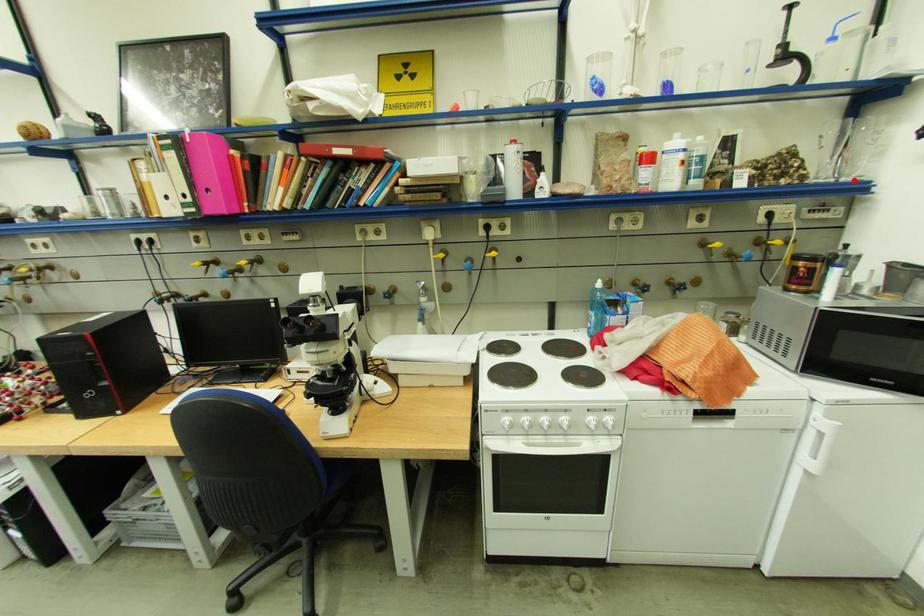
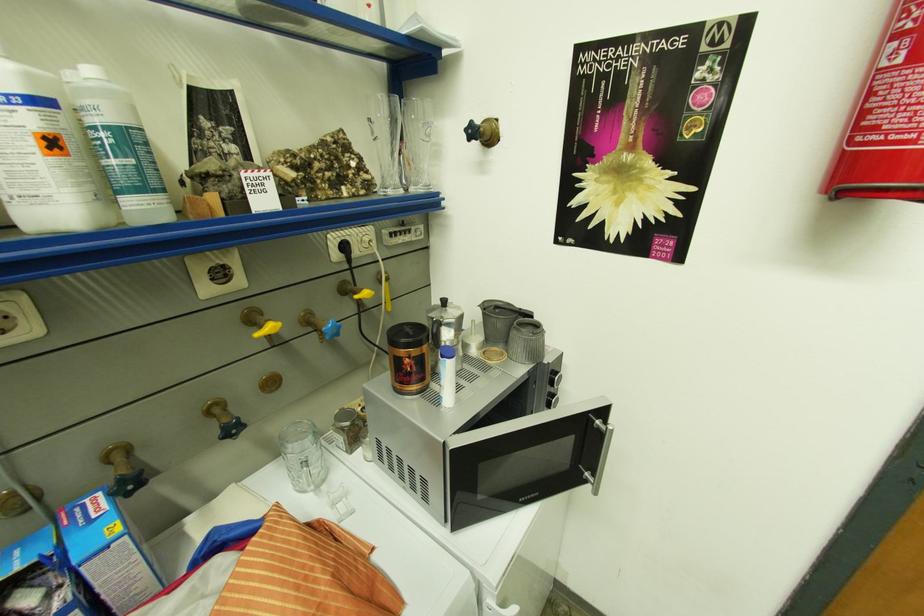
In the second image, find the point that corresponds to the highlighted location in the first image.

(422, 191)